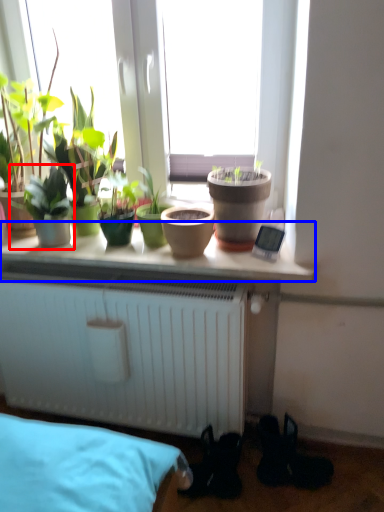
Question: Among these objects, which one is farthest to the camera, houseplant (highlighted by a red box) or window sill (highlighted by a blue box)?

Choices:
 (A) houseplant
 (B) window sill

Answer: (A)